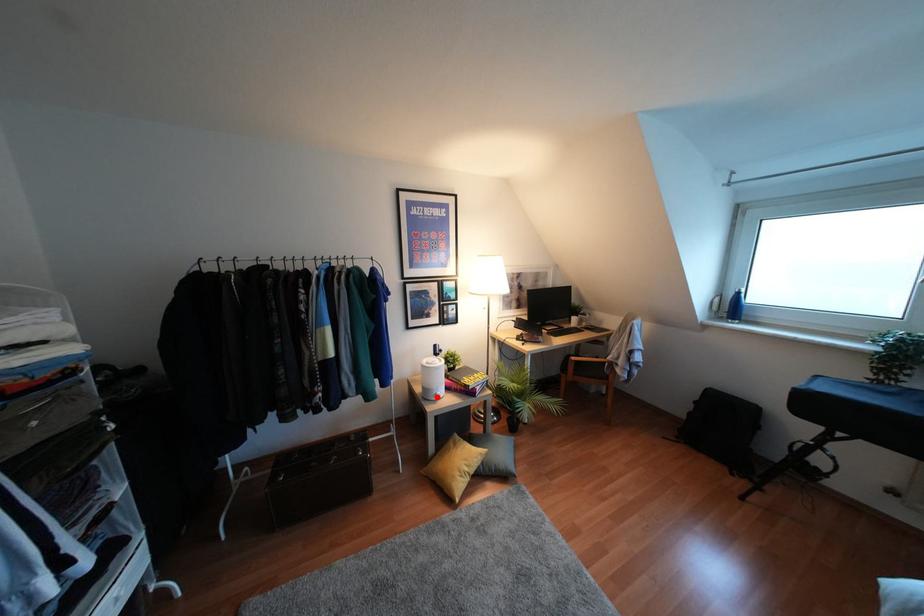
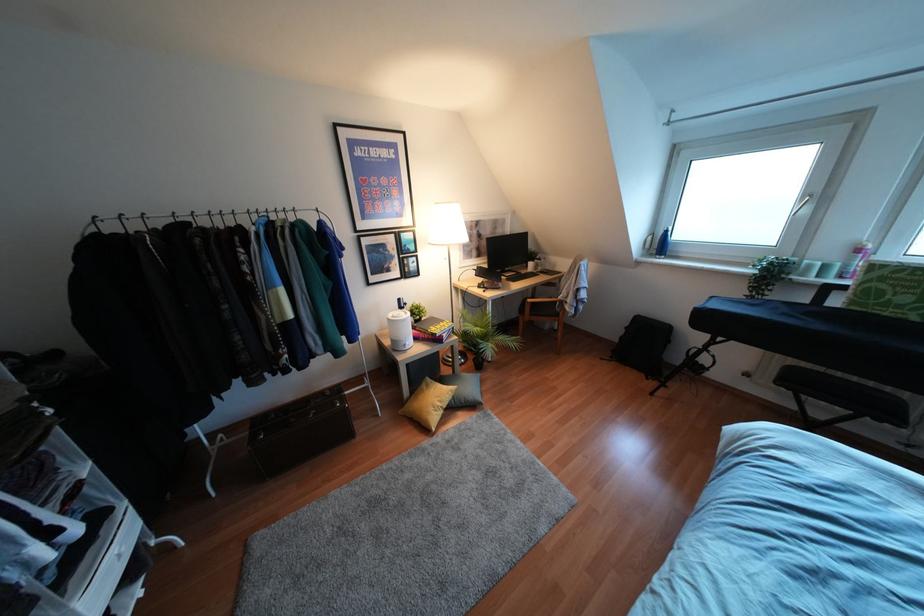
The point at the highlighted location is marked in the first image. Where is the corresponding point in the second image?

(407, 347)